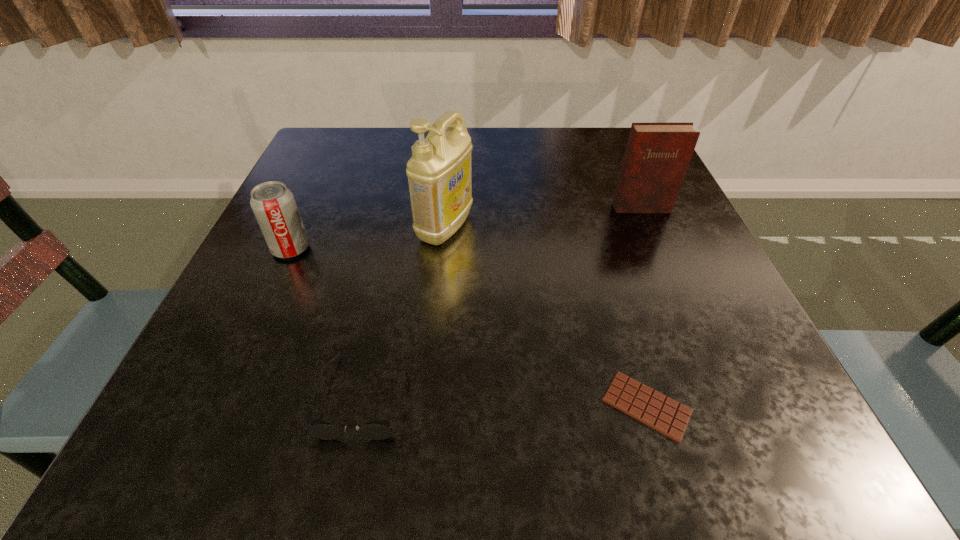
The image size is (960, 540). Find the location of `free space at the far left corner of the desktop`. free space at the far left corner of the desktop is located at coordinates (374, 131).

Image resolution: width=960 pixels, height=540 pixels. Identify the location of free region at the near left corner. (228, 402).

Find the location of a particular element. Image resolution: width=960 pixels, height=540 pixels. vacant region at the far right corner of the desktop is located at coordinates (607, 132).

You are a GUI agent. You are given a task and a screenshot of the screen. Output one action in this format:
    pyautogui.click(x=<x>, y=<y>)
    Task: Click on the free region at the near right corner
    The width and height of the screenshot is (960, 540).
    Given the screenshot: What is the action you would take?
    pyautogui.click(x=738, y=427)

Locate an element on the screen. The image size is (960, 540). empty location between the soda can and the detergent is located at coordinates (368, 238).

The image size is (960, 540). In order to click on free spot between the shortest object and the detergent in this screenshot , I will do `click(546, 317)`.

This screenshot has width=960, height=540. I want to click on free spot between the leftmost object and the sunglasses, so click(327, 322).

The image size is (960, 540). What are the coordinates of `free spot between the tallest object and the second tallest object` in the screenshot? It's located at (542, 218).

Where is `unoccupied area between the third tallest object and the diary`? This screenshot has width=960, height=540. unoccupied area between the third tallest object and the diary is located at coordinates (466, 228).

Where is `unoccupied position between the candy bar and the fourth tallest object`? Image resolution: width=960 pixels, height=540 pixels. unoccupied position between the candy bar and the fourth tallest object is located at coordinates (505, 400).